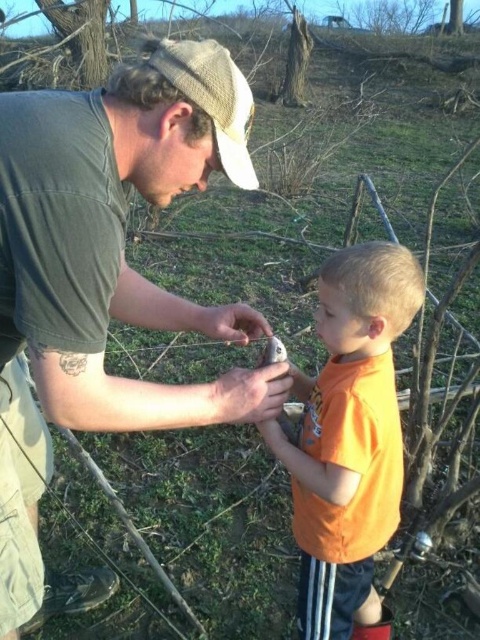
Question: Is orange cotton shirt at center to the right of knitted beige cap at upper center from the viewer's perspective?

Choices:
 (A) no
 (B) yes

Answer: (B)

Question: Which point appears farthest from the camera in this image?

Choices:
 (A) (240, 184)
 (B) (92, 100)
 (C) (228, 376)
 (D) (359, 420)

Answer: (D)

Question: Can you confirm if matte green shirt at center is positioned below orange cotton shirt at center?

Choices:
 (A) no
 (B) yes

Answer: (A)

Question: Based on their relative distances, which object is nearer to the orange cotton shirt at center?

Choices:
 (A) matte green shirt at center
 (B) smooth skin hand at center

Answer: (B)

Question: Does matte green shirt at center appear on the right side of matte plastic hand at center?

Choices:
 (A) no
 (B) yes

Answer: (A)

Question: Which object is positioned closest to the knitted beige cap at upper center?

Choices:
 (A) orange cotton shirt at center
 (B) smooth skin hand at center
 (C) matte plastic hand at center
 (D) matte green shirt at center

Answer: (C)